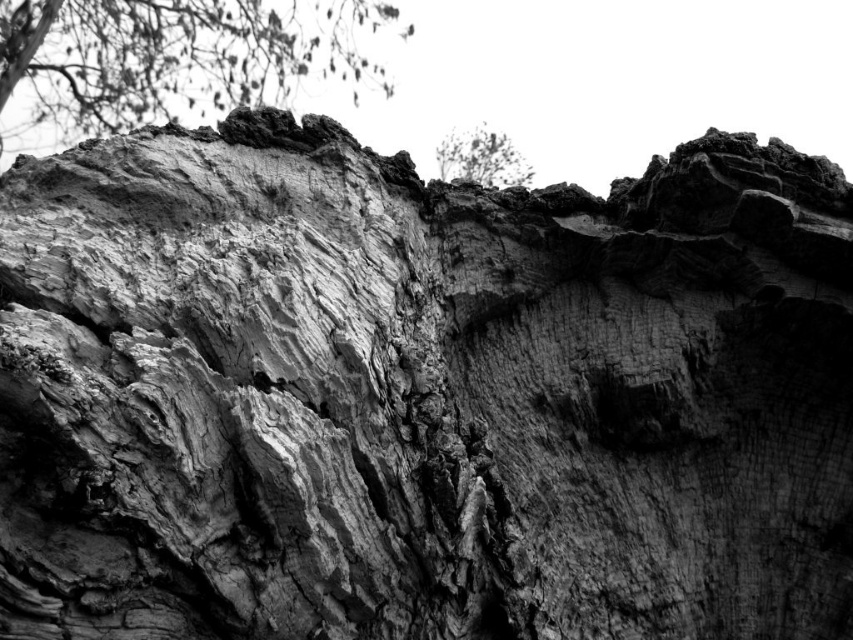
You are standing in front of a tree trunk with rough bark at upper left. Where exactly is the rough bark tree trunk at upper left located in terms of coordinates?

The rough bark tree trunk at upper left is located at coordinates point (178, 54).

Looking at the black and white photo of the tree trunk, where is the rough bark tree trunk at upper left in relation to the dark gray textured bark at upper center?

The rough bark tree trunk at upper left is positioned to the left of the dark gray textured bark at upper center.